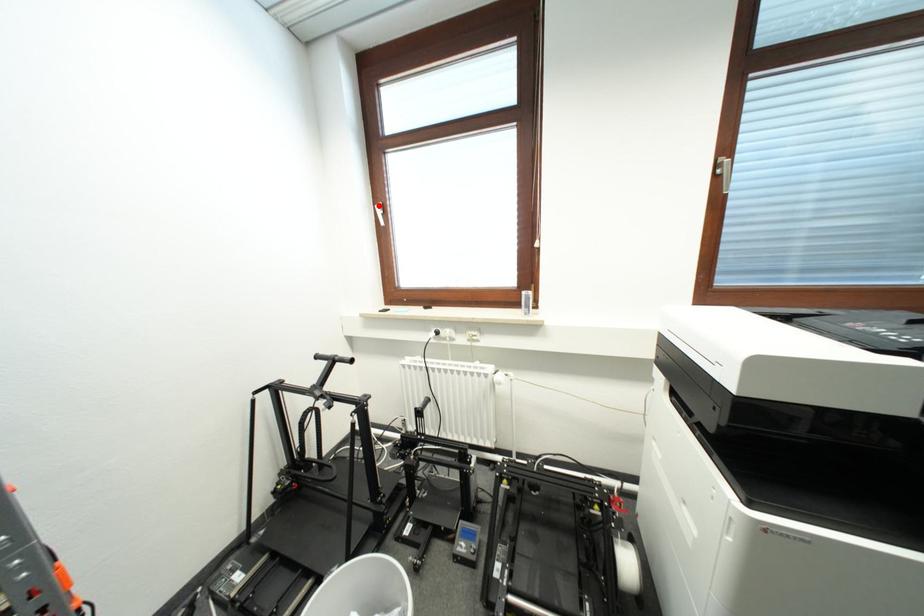
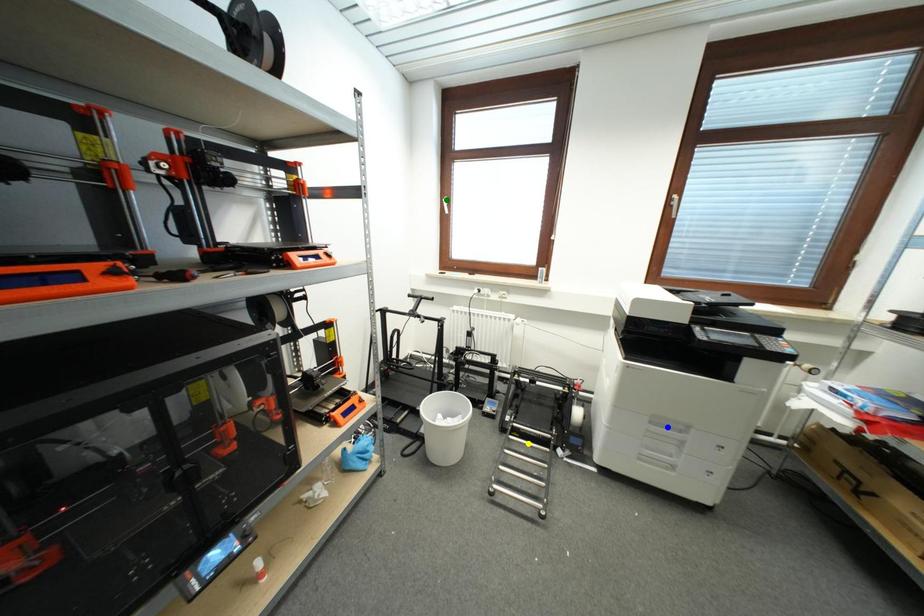
Question: I am providing you with two images of the same scene from different viewpoints. A red point is marked on the first image. You are given multiple points on the second image. Which mark in image 2 goes with the point in image 1?

Choices:
 (A) blue point
 (B) yellow point
 (C) green point

Answer: (C)